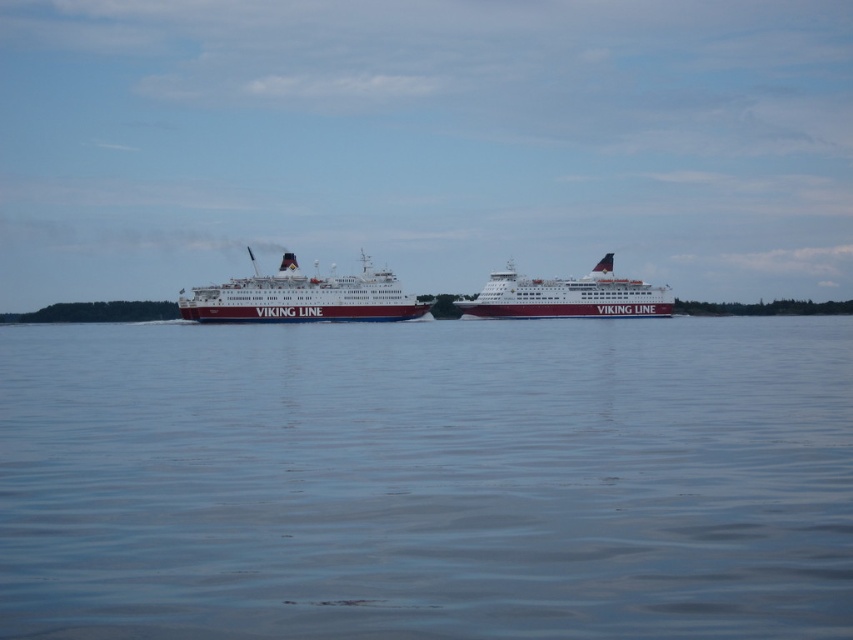
Which is below, blue smooth water at center or red polished ship at center?

blue smooth water at center is lower down.

Is point (155, 465) more distant than point (358, 282)?

No, it is not.

Where is `blue smooth water at center`? The image size is (853, 640). blue smooth water at center is located at coordinates (427, 480).

Which is more to the right, red polished ship at center or maroon glossy ship at center?

maroon glossy ship at center is more to the right.

Does point (309, 316) come behind point (547, 292)?

No, it is in front of (547, 292).

In order to click on red polished ship at center in this screenshot , I will do `click(302, 298)`.

Can you confirm if blue smooth water at center is bigger than maroon glossy ship at center?

Yes.

Does point (764, 449) lie in front of point (642, 312)?

Yes, point (764, 449) is in front of point (642, 312).

At what (x,y) coordinates should I click in order to perform the action: click on blue smooth water at center. Please return your answer as a coordinate pair (x, y). Looking at the image, I should click on (427, 480).